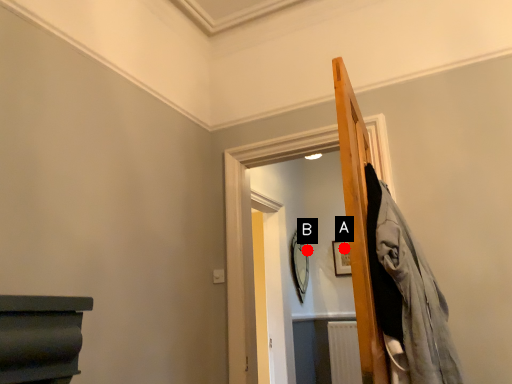
Question: Two points are circled on the image, labeled by A and B beside each circle. Which point is farther from the camera taking this photo?

Choices:
 (A) A is further
 (B) B is further

Answer: (A)